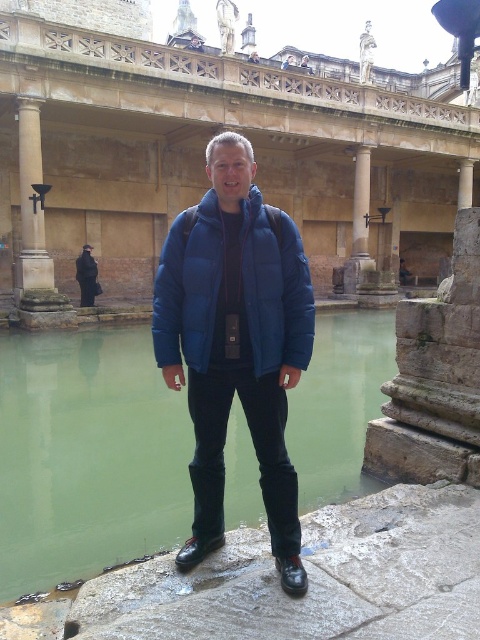
Measure the distance from matte blue jacket at center to beige stone pillar at center.

matte blue jacket at center and beige stone pillar at center are 34.45 meters apart from each other.

Does point (195, 358) come closer to viewer compared to point (367, 148)?

Yes, it is in front of point (367, 148).

Between point (180, 218) and point (358, 228), which one is positioned behind?

Positioned behind is point (358, 228).

Where is `matte blue jacket at center`? matte blue jacket at center is located at coordinates (276, 291).

Does matte stone palace at center have a lesser width compared to green stone pool at center?

No.

Measure the distance between point (50, 147) and camera.

The distance of point (50, 147) from camera is 62.83 meters.

Is point (291, 93) farther from camera compared to point (19, 349)?

That is True.

Where is `matte stone palace at center`? matte stone palace at center is located at coordinates (203, 150).

Looking at this image, measure the distance between point (365, 232) and camera.

Point (365, 232) and camera are 72.81 meters apart from each other.

Between beige stone pillar at center and matte blue coat at center, which one is positioned lower?

Positioned lower is matte blue coat at center.

At what (x,y) coordinates should I click in order to perform the action: click on beige stone pillar at center. Please return your answer as a coordinate pair (x, y). The height and width of the screenshot is (640, 480). Looking at the image, I should click on (360, 202).